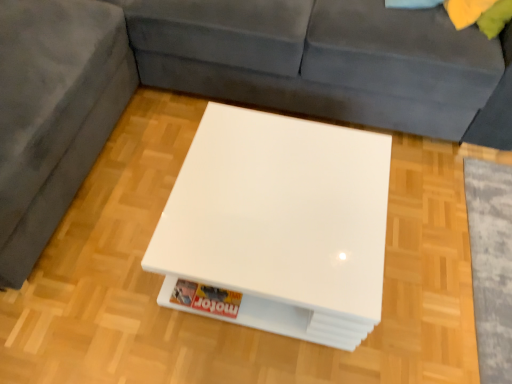
This screenshot has height=384, width=512. I want to click on vacant area that lies to the right of white glossy table at center, so click(x=439, y=259).